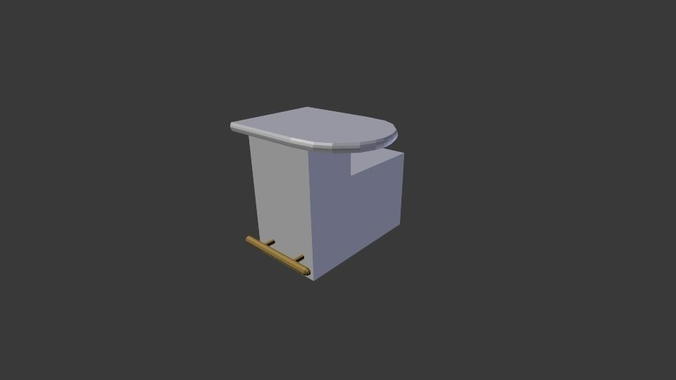
Where is `handle`? This screenshot has width=676, height=380. handle is located at coordinates (274, 252).